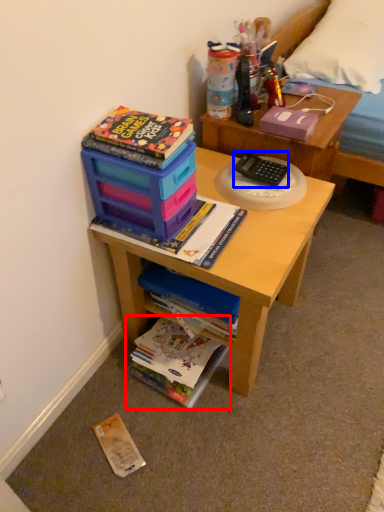
Question: Which object is closer to the camera taking this photo, book (highlighted by a red box) or stationery (highlighted by a blue box)?

Choices:
 (A) book
 (B) stationery

Answer: (B)